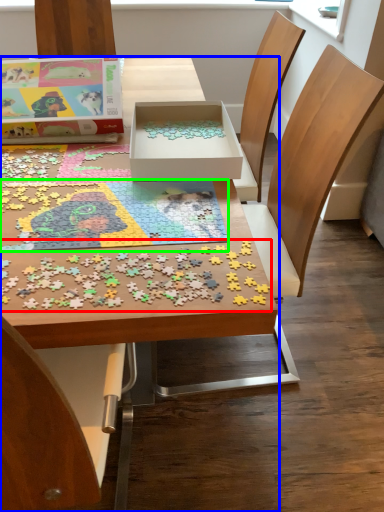
Question: Considering the real-world distances, which object is farthest from jigsaw puzzle (highlighted by a red box)? table (highlighted by a blue box) or jigsaw puzzle (highlighted by a green box)?

Choices:
 (A) table
 (B) jigsaw puzzle

Answer: (A)